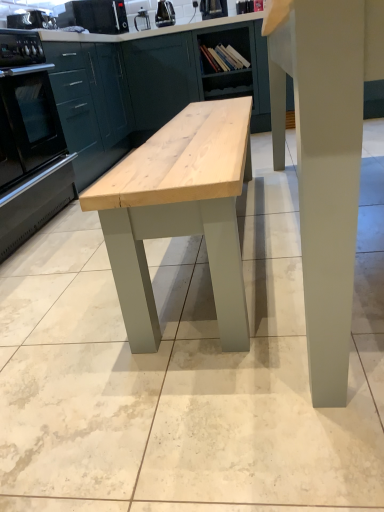
Question: Which direction should I rotate to look at wooden bookshelf at center, placed as the 1th cabinetry when sorted from right to left, — up or down?

Choices:
 (A) up
 (B) down

Answer: (A)

Question: Does metallic silver toaster at upper center, the 1th appliance positioned from the right, appear on the left side of smooth gray table at center?

Choices:
 (A) no
 (B) yes

Answer: (B)

Question: From the image's perspective, does metallic silver toaster at upper center, the 1th appliance positioned from the right, appear lower than smooth gray table at center?

Choices:
 (A) yes
 (B) no

Answer: (B)

Question: Does metallic silver toaster at upper center, marked as the 4th appliance in a left-to-right arrangement, have a greater height compared to smooth gray table at center?

Choices:
 (A) yes
 (B) no

Answer: (B)

Question: From the image's perspective, does metallic silver toaster at upper center, marked as the 4th appliance in a left-to-right arrangement, appear higher than smooth gray table at center?

Choices:
 (A) yes
 (B) no

Answer: (A)

Question: From a real-world perspective, is metallic silver toaster at upper center, the 1th appliance positioned from the right, physically below smooth gray table at center?

Choices:
 (A) no
 (B) yes

Answer: (A)

Question: Does metallic silver toaster at upper center, marked as the 4th appliance in a left-to-right arrangement, have a larger size compared to smooth gray table at center?

Choices:
 (A) no
 (B) yes

Answer: (A)

Question: From a real-world perspective, is black plastic kettle at upper center, positioned as the 3th appliance in left-to-right order, beneath matte green cabinet at center, which is the 2th cabinetry in right-to-left order?

Choices:
 (A) no
 (B) yes

Answer: (A)

Question: Is black plastic kettle at upper center, positioned as the 3th appliance in left-to-right order, closer to camera compared to matte green cabinet at center, which is the 2th cabinetry in right-to-left order?

Choices:
 (A) no
 (B) yes

Answer: (A)

Question: Is black plastic kettle at upper center, positioned as the 3th appliance in left-to-right order, to the right of matte green cabinet at center, which is the 2th cabinetry in right-to-left order, from the viewer's perspective?

Choices:
 (A) yes
 (B) no

Answer: (B)

Question: Is black plastic kettle at upper center, the 2th appliance positioned from the right, outside matte green cabinet at center, which ranks as the 2th cabinetry in left-to-right order?

Choices:
 (A) yes
 (B) no

Answer: (A)

Question: Is black plastic kettle at upper center, positioned as the 3th appliance in left-to-right order, bigger than matte green cabinet at center, which ranks as the 2th cabinetry in left-to-right order?

Choices:
 (A) yes
 (B) no

Answer: (B)

Question: Can you confirm if black plastic kettle at upper center, the 2th appliance positioned from the right, is thinner than matte green cabinet at center, which is the 2th cabinetry in right-to-left order?

Choices:
 (A) no
 (B) yes

Answer: (B)

Question: Can metallic silver toaster at upper center, the 1th appliance positioned from the right, be found inside black plastic toaster at upper left, which ranks as the first appliance in left-to-right order?

Choices:
 (A) no
 (B) yes

Answer: (A)